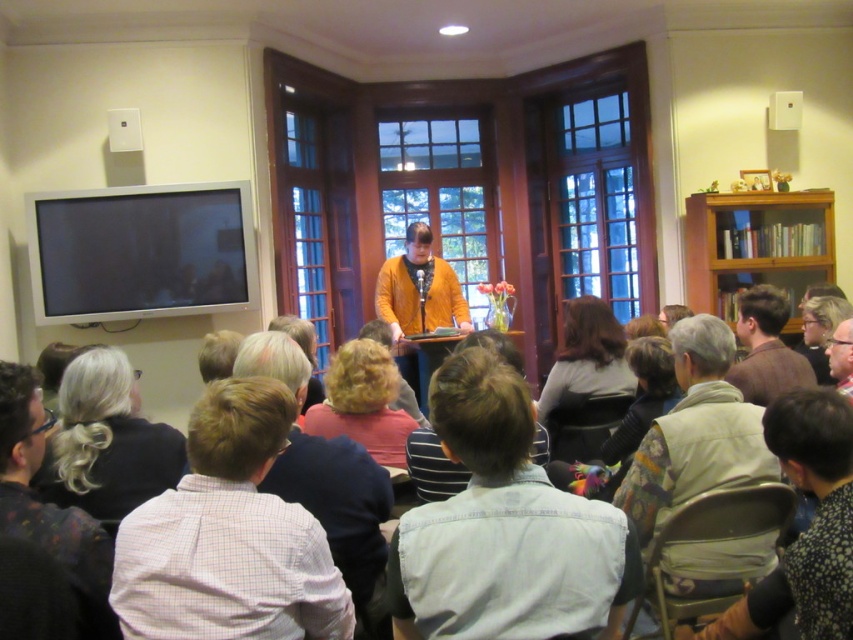
Question: Does denim shirt at lower center have a lesser width compared to light brown fabric vest at lower right?

Choices:
 (A) no
 (B) yes

Answer: (B)

Question: In this image, where is blonde hair at center located relative to light brown hair at lower right?

Choices:
 (A) right
 (B) left

Answer: (B)

Question: Which point is farther to the camera?

Choices:
 (A) denim shirt at lower center
 (B) white checkered shirt at lower left
 (C) blonde hair at center
 (D) dark brown hair at center

Answer: (D)

Question: Based on their relative distances, which object is farther from the wooden bookshelf at right?

Choices:
 (A) light brown hair at lower right
 (B) brown wool sweater at lower right
 (C) floral-patterned shirt at lower right
 (D) blonde hair at center

Answer: (C)

Question: Does floral-patterned shirt at lower right have a larger size compared to wooden bookshelf at right?

Choices:
 (A) yes
 (B) no

Answer: (B)

Question: Considering the real-world distances, which object is farthest from the white checkered shirt at lower left?

Choices:
 (A) floral-patterned shirt at lower right
 (B) light brown hair at lower right
 (C) dark brown hair at center
 (D) blonde hair at center

Answer: (B)